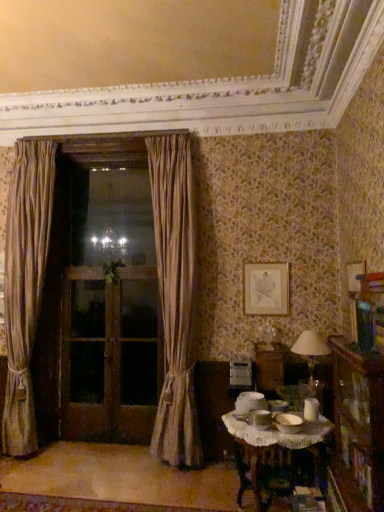
Question: Should I look upward or downward to see matte silver picture frame at upper center?

Choices:
 (A) down
 (B) up

Answer: (A)

Question: Does silky beige curtain at left, the 1th curtain from the left, have a greater width compared to brown wooden screen door at left, which ranks as the third screen door in right-to-left order?

Choices:
 (A) yes
 (B) no

Answer: (A)

Question: Is silky beige curtain at left, the 1th curtain from the left, taller than brown wooden screen door at left, which is counted as the first screen door, starting from the left?

Choices:
 (A) yes
 (B) no

Answer: (A)

Question: Is silky beige curtain at left, the 1th curtain from the left, outside of brown wooden screen door at left, which is counted as the first screen door, starting from the left?

Choices:
 (A) no
 (B) yes

Answer: (B)

Question: Does silky beige curtain at left, marked as the 2th curtain in a right-to-left arrangement, have a larger size compared to brown wooden screen door at left, which ranks as the third screen door in right-to-left order?

Choices:
 (A) no
 (B) yes

Answer: (B)

Question: Is silky beige curtain at left, the 1th curtain from the left, positioned in front of brown wooden screen door at left, which ranks as the third screen door in right-to-left order?

Choices:
 (A) no
 (B) yes

Answer: (B)

Question: Is silky beige curtain at left, marked as the 2th curtain in a right-to-left arrangement, smaller than brown wooden screen door at left, which is counted as the first screen door, starting from the left?

Choices:
 (A) yes
 (B) no

Answer: (B)

Question: Does wooden bookcase at lower right appear on the left side of white lace tablecloth at lower right?

Choices:
 (A) no
 (B) yes

Answer: (A)

Question: Can you confirm if wooden bookcase at lower right is bigger than white lace tablecloth at lower right?

Choices:
 (A) no
 (B) yes

Answer: (A)

Question: Can you confirm if wooden bookcase at lower right is shorter than white lace tablecloth at lower right?

Choices:
 (A) no
 (B) yes

Answer: (A)

Question: Would you say wooden bookcase at lower right is a long distance from white lace tablecloth at lower right?

Choices:
 (A) yes
 (B) no

Answer: (B)

Question: Can you confirm if wooden bookcase at lower right is taller than white lace tablecloth at lower right?

Choices:
 (A) no
 (B) yes

Answer: (B)

Question: Is wooden bookcase at lower right positioned with its back to white lace tablecloth at lower right?

Choices:
 (A) no
 (B) yes

Answer: (A)

Question: From the image's perspective, is wooden bookcase at lower right beneath brown wooden screen door at left, which is counted as the first screen door, starting from the left?

Choices:
 (A) yes
 (B) no

Answer: (B)